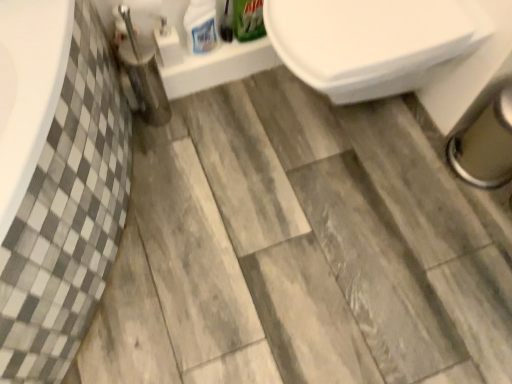
What are the coordinates of `free point in front of brushed metal toilet brush at lower left` in the screenshot? It's located at (161, 157).